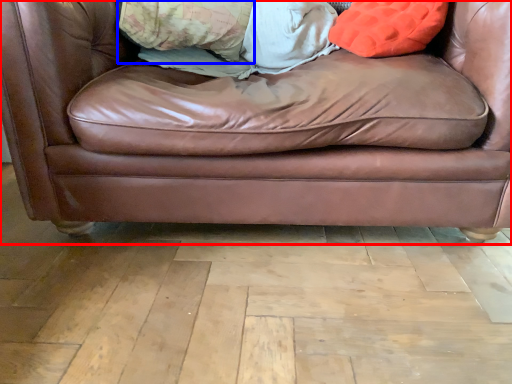
Question: Which object appears closest to the camera in this image, studio couch (highlighted by a red box) or pillow (highlighted by a blue box)?

Choices:
 (A) studio couch
 (B) pillow

Answer: (A)